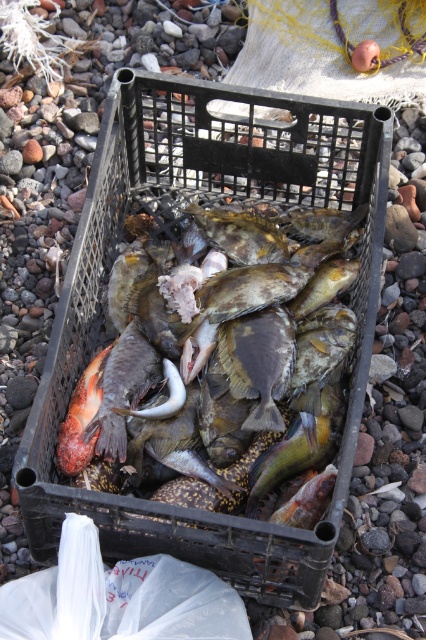
You are standing at the point marked as point [247,310]. Which fish is directly in front of you?

The speckled skin fish at center is located at point [247,310], so it is directly in front of you.

You are a fisherman who needs to identify the position of the fish in the crate. Which fish is located to the right of the other between the speckled skin fish at center and the shiny silver fish at center?

The speckled skin fish at center is located to the right of the shiny silver fish at center.